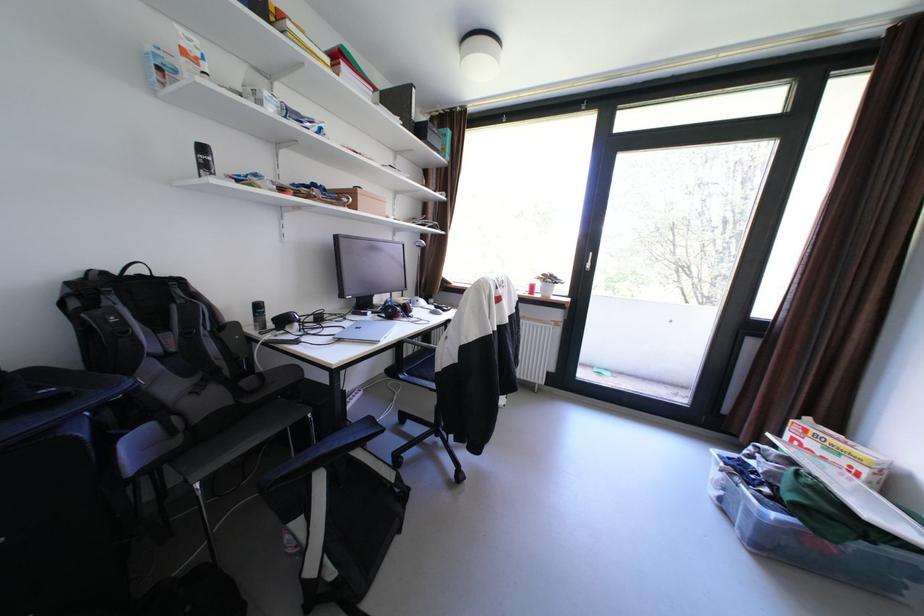
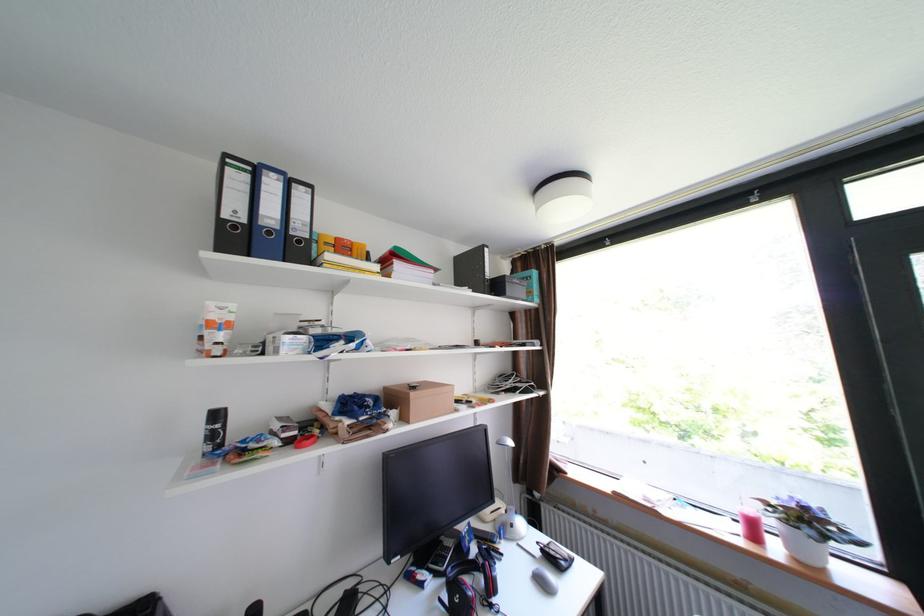
In the second image, find the point that corresponds to pixel 550 285 in the first image.

(782, 523)